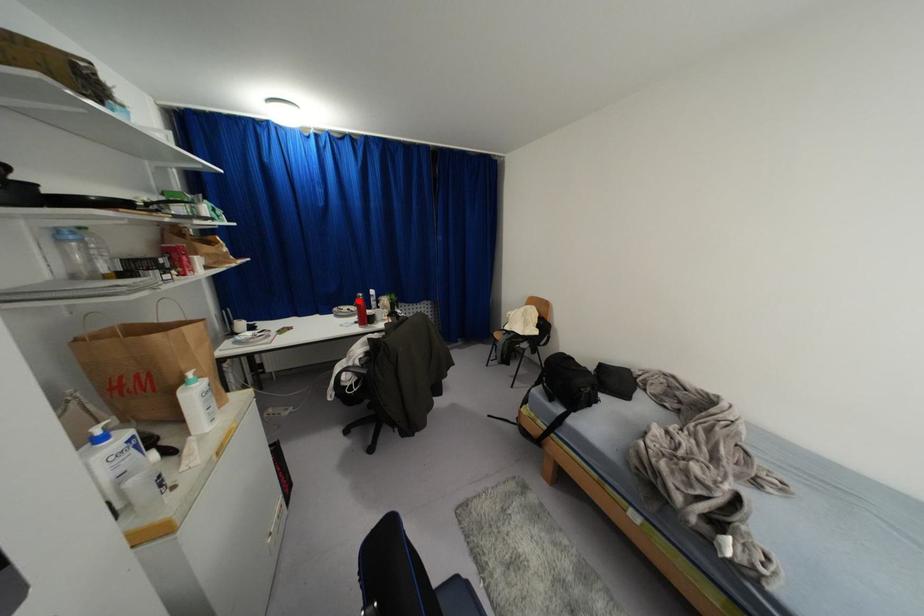
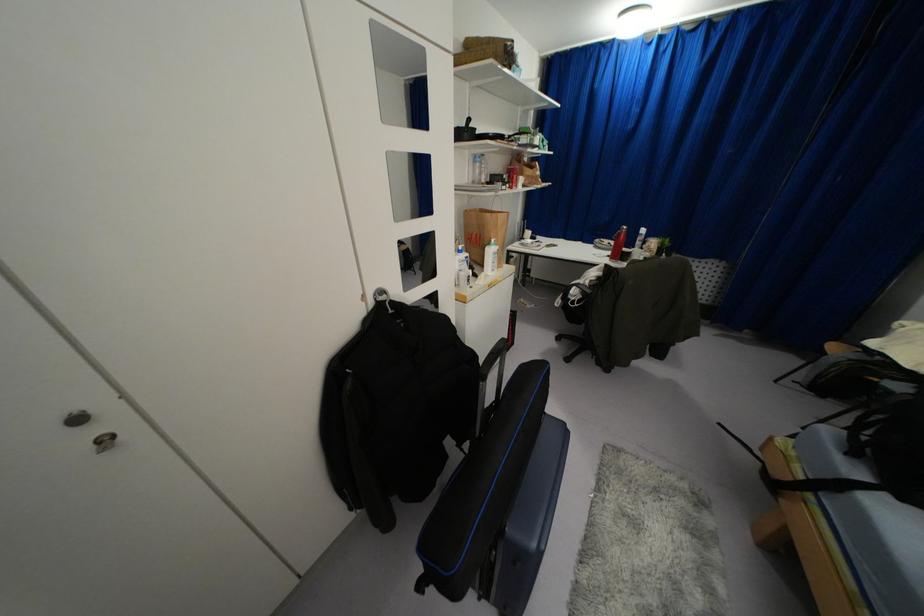
In the second image, find the point that corresponds to the highlighted location in the first image.

(618, 233)